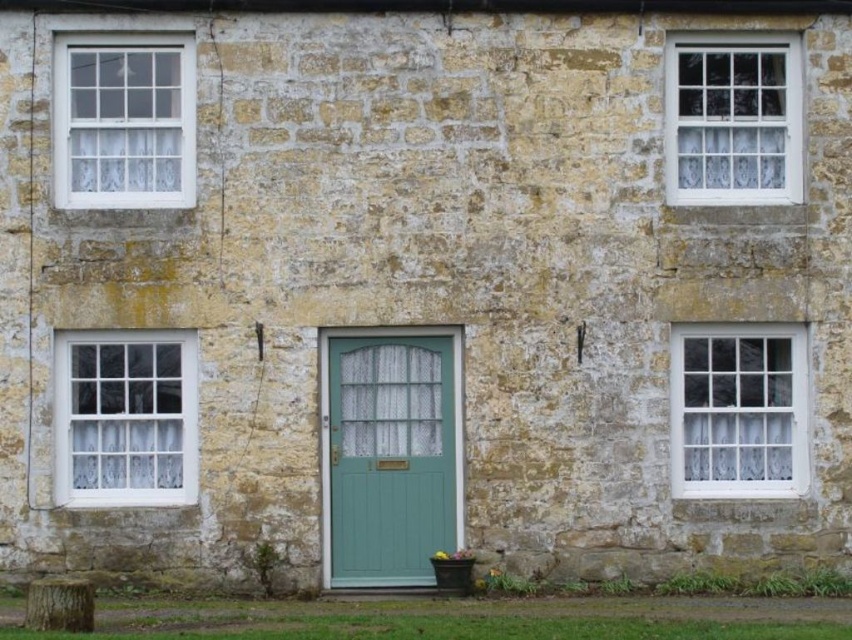
Question: Can you confirm if white lace curtain at lower left is positioned above white textured glass window at upper right?

Choices:
 (A) yes
 (B) no

Answer: (B)

Question: Is teal matte door at center positioned in front of white textured glass window at lower right?

Choices:
 (A) no
 (B) yes

Answer: (B)

Question: Estimate the real-world distances between objects in this image. Which object is closer to the teal matte door at center?

Choices:
 (A) white textured glass window at lower right
 (B) white lace curtain at lower left

Answer: (B)

Question: Which of the following is the farthest from the observer?

Choices:
 (A) white textured glass window at upper right
 (B) teal matte door at center

Answer: (A)

Question: Among these points, which one is nearest to the camera?

Choices:
 (A) coord(159,467)
 (B) coord(432,371)
 (C) coord(672,90)
 (D) coord(110,172)

Answer: (A)

Question: Does teal matte door at center appear under white lace curtain at lower left?

Choices:
 (A) no
 (B) yes

Answer: (B)